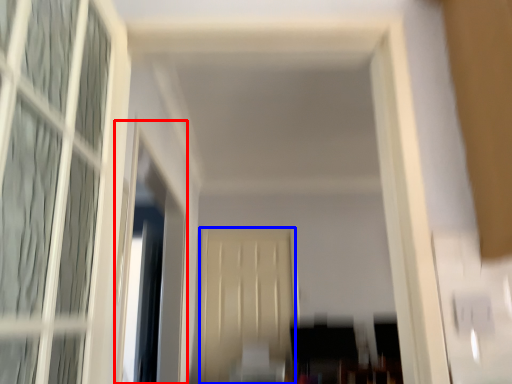
Question: Which point is further to the camera, window screen (highlighted by a red box) or screen door (highlighted by a blue box)?

Choices:
 (A) window screen
 (B) screen door

Answer: (B)